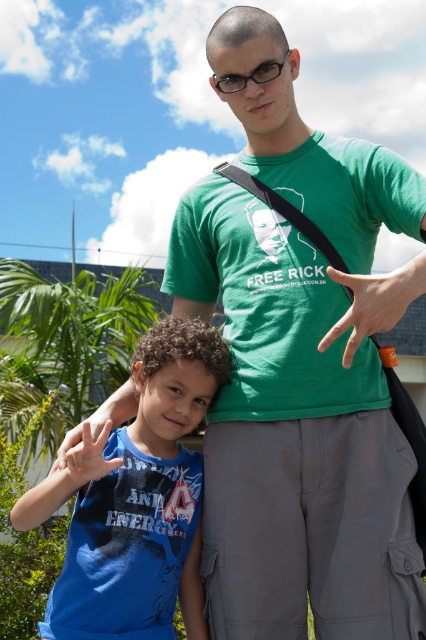
Based on the photo, you are a photographer trying to capture a closeup of the orange rubber band at center. However, the blue cotton shirt at lower left is blocking your view. Can you adjust your position to take the photo without moving either object?

The blue cotton shirt at lower left is in front of the orange rubber band at center, so you need to move your camera position to an angle where the blue cotton shirt at lower left is no longer blocking the orange rubber band at center.